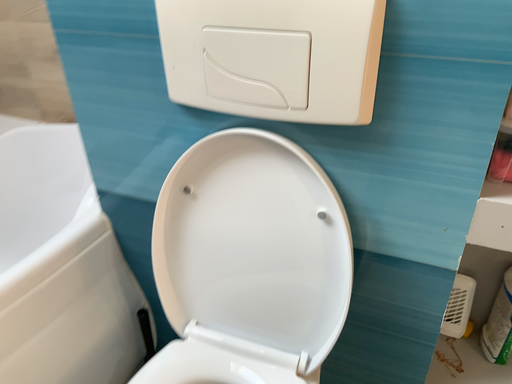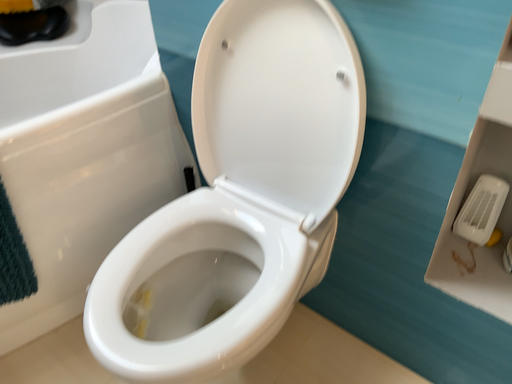
Question: Which way did the camera rotate in the video?

Choices:
 (A) rotated left
 (B) rotated right

Answer: (A)